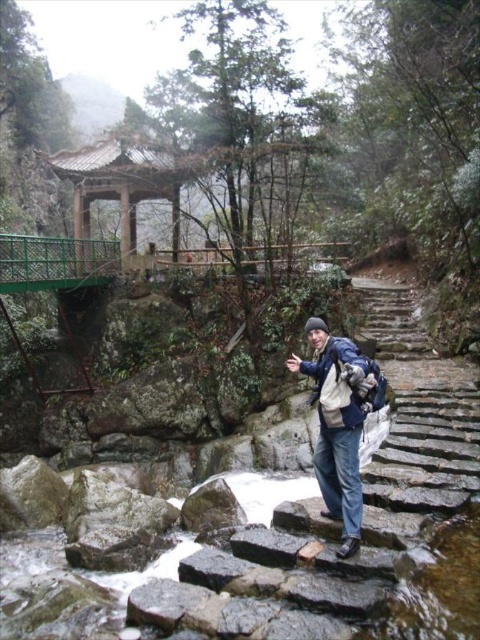
You are a hiker who wants to take a break under the wooden gazebo at upper center. You are currently standing next to the blue fabric backpack at center. Which direction should you move to reach the gazebo?

The wooden gazebo at upper center is above the blue fabric backpack at center, so you should move upward to reach the gazebo.

You are a hiker who wants to reach the wooden gazebo at upper center. You are currently standing near the blue fabric backpack at center. Which direction should you move to get closer to the gazebo?

The blue fabric backpack at center is positioned on the right side of wooden gazebo at upper center, so you should move to the left to get closer to the gazebo.

You are a hiker who wants to know if your blue fabric backpack at center can fit inside the wooden gazebo at upper center. Can it?

The blue fabric backpack at center is bigger than the wooden gazebo at upper center, so it cannot fit inside.